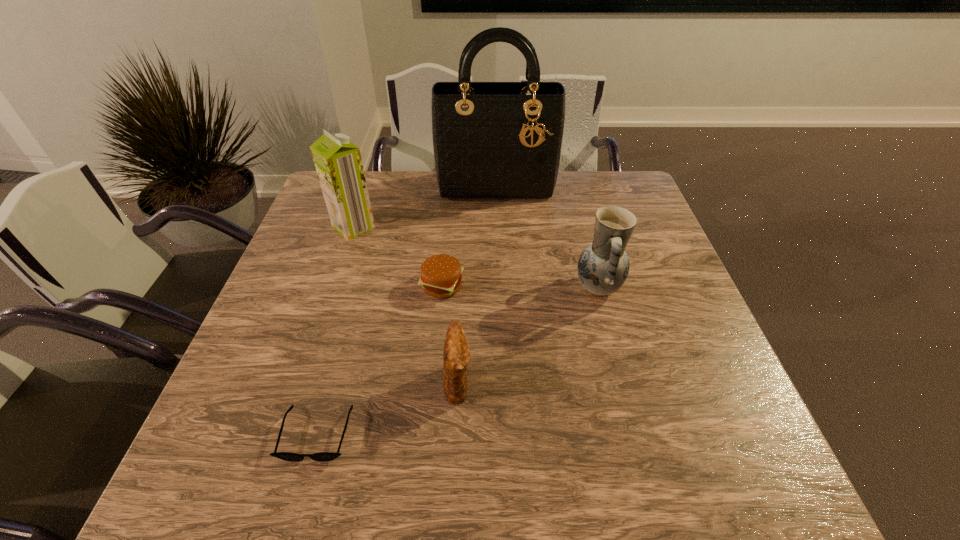
This screenshot has width=960, height=540. Identify the location of soya milk situated at the left edge. (338, 162).

This screenshot has width=960, height=540. I want to click on sunglasses at the left edge, so click(x=287, y=456).

Identify the location of object that is at the right edge. (603, 266).

Identify the location of object that is at the far left corner. (338, 162).

The height and width of the screenshot is (540, 960). I want to click on object that is at the near left corner, so click(287, 456).

The image size is (960, 540). In the image, there is a desktop. Identify the location of free space at the far edge. (417, 188).

The width and height of the screenshot is (960, 540). In the image, there is a desktop. Identify the location of blank space at the near edge. (379, 500).

This screenshot has width=960, height=540. I want to click on vacant area at the left edge, so click(259, 381).

At what (x,y) coordinates should I click in order to perform the action: click on free space at the right edge of the desktop. Please return your answer as a coordinate pair (x, y). Looking at the image, I should click on (665, 383).

In the image, there is a desktop. In order to click on vacant space at the far right corner in this screenshot , I will do `click(611, 178)`.